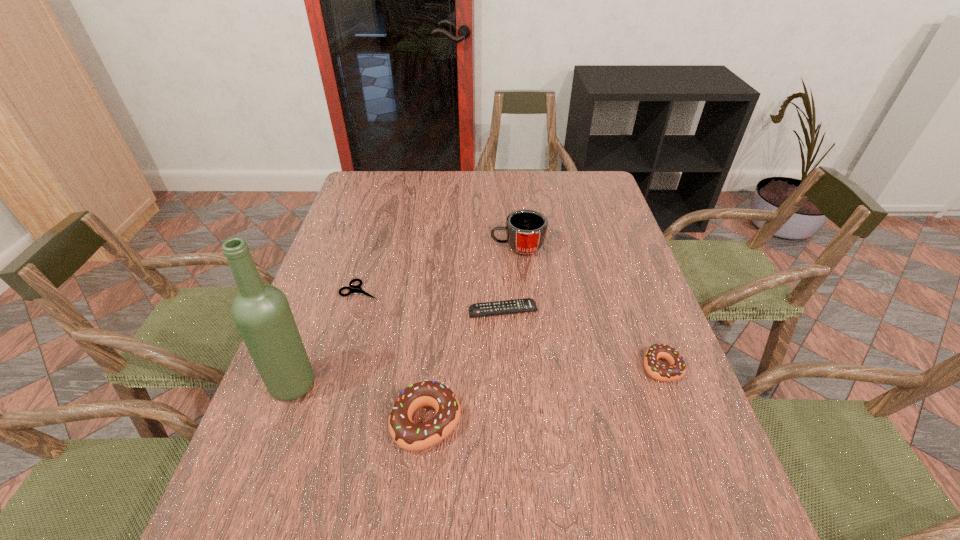
To achieve even spacing by inserting another doughnut among them, please point to a vacant spot for this new doughnut. Please provide its 2D coordinates. Your answer should be formatted as a tuple, i.e. [(x, y)], where the tuple contains the x and y coordinates of a point satisfying the conditions above.

[(550, 393)]